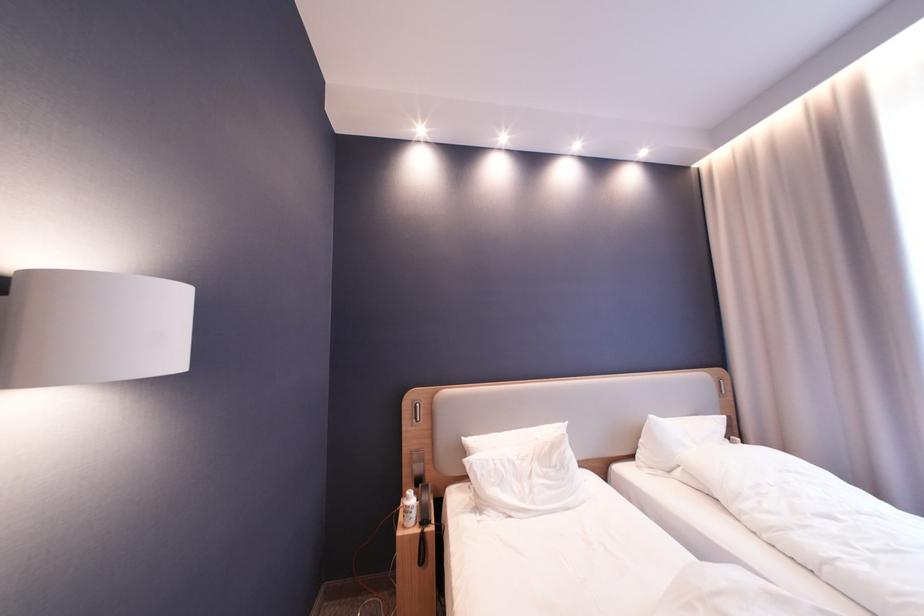
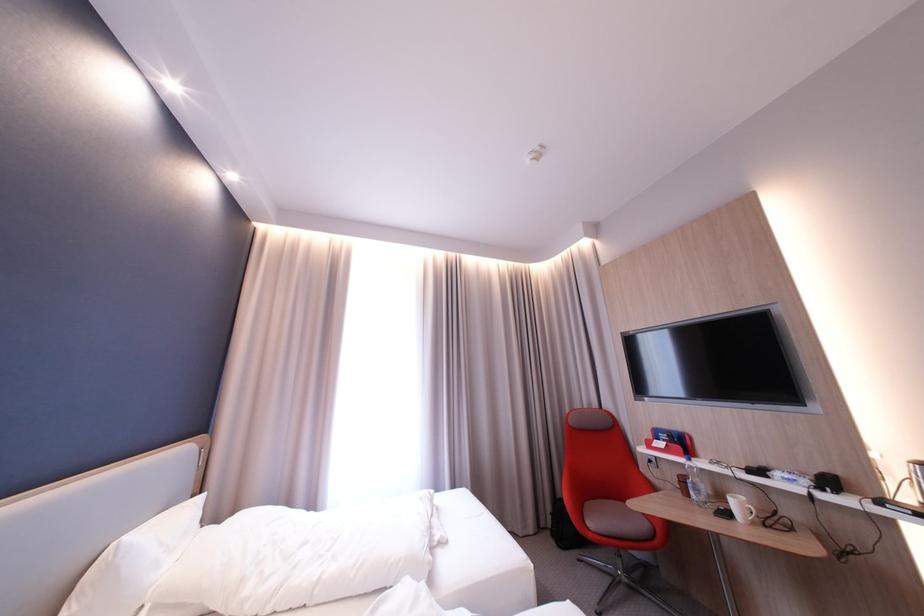
How did the camera likely rotate?

The rotation direction of the camera is right-up.